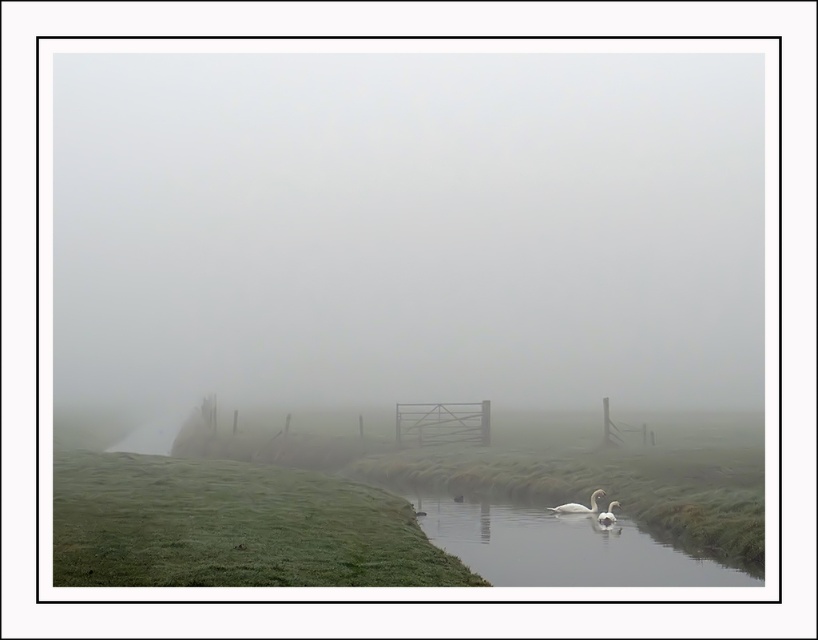
You are a wildlife photographer aiming to capture a closeup shot of the white glossy swan at lower center from the clear water at center. Given that your camera lens has a minimum focusing distance of 2 meters, will you be able to take the photo without moving closer?

The distance between the clear water at center and the white glossy swan at lower center is 2.23 meters. Since the minimum focusing distance of the camera lens is 2 meters, you can take the photo without moving closer as the swan is within range.

You are standing at the center of the image and want to walk to the green grassy hillside at lower left. Which direction should you move in?

To reach the green grassy hillside at lower left from the center, you should move towards the lower left direction since it is located at point [232,525].